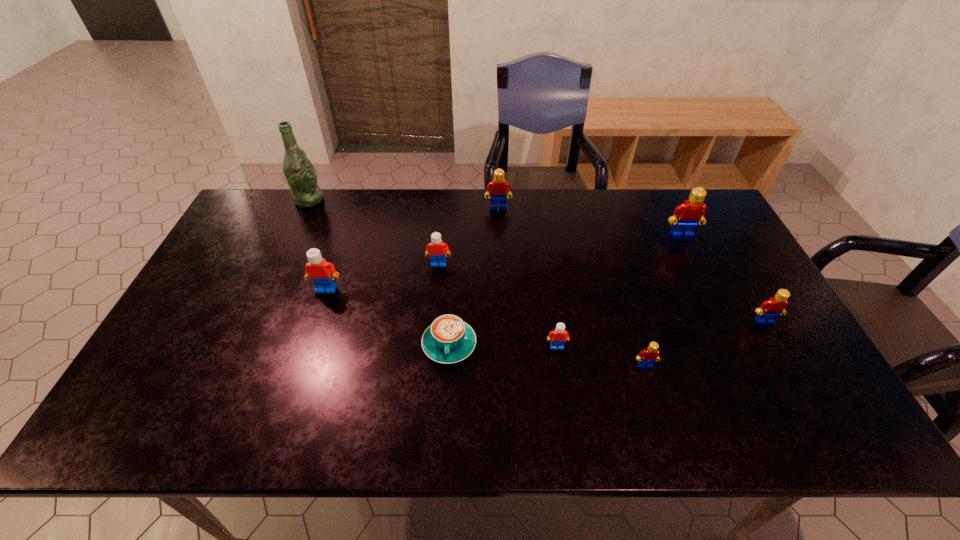
The height and width of the screenshot is (540, 960). I want to click on blank space located on the front-facing side of the second biggest red Lego, so click(x=499, y=227).

This screenshot has width=960, height=540. In order to click on blank area located on the face of the second object from left to right in this screenshot , I will do `click(290, 400)`.

The height and width of the screenshot is (540, 960). What are the coordinates of `blank space located 0.100m on the face of the fourth farthest object` in the screenshot? It's located at (436, 292).

Identify the location of free space located on the front-facing side of the second nearest red Lego. (819, 417).

You are a GUI agent. You are given a task and a screenshot of the screen. Output one action in this format:
    pyautogui.click(x=<x>, y=<y>)
    Task: Click on the vacant space located on the front-facing side of the third Lego from right to left
    The height and width of the screenshot is (540, 960).
    Given the screenshot: What is the action you would take?
    pyautogui.click(x=655, y=399)

Where is `vacant space situated 0.060m on the face of the nearest white Lego`? vacant space situated 0.060m on the face of the nearest white Lego is located at coordinates (561, 370).

Where is `blank area located 0.110m with the handle on the right side of the shortest object`? The width and height of the screenshot is (960, 540). blank area located 0.110m with the handle on the right side of the shortest object is located at coordinates (445, 409).

This screenshot has width=960, height=540. Identify the location of beer bottle situated at the far edge. (299, 172).

What are the coordinates of `object that is at the left edge` in the screenshot? It's located at (299, 172).

At what (x,y) coordinates should I click in order to perform the action: click on object located in the far left corner section of the desktop. Please return your answer as a coordinate pair (x, y). The height and width of the screenshot is (540, 960). Looking at the image, I should click on click(299, 172).